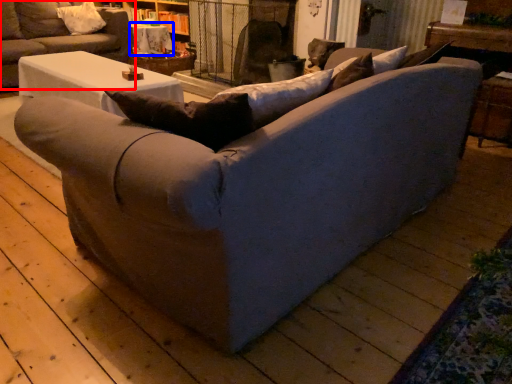
Question: Which object is closer to the camera taking this photo, studio couch (highlighted by a red box) or table (highlighted by a blue box)?

Choices:
 (A) studio couch
 (B) table

Answer: (A)